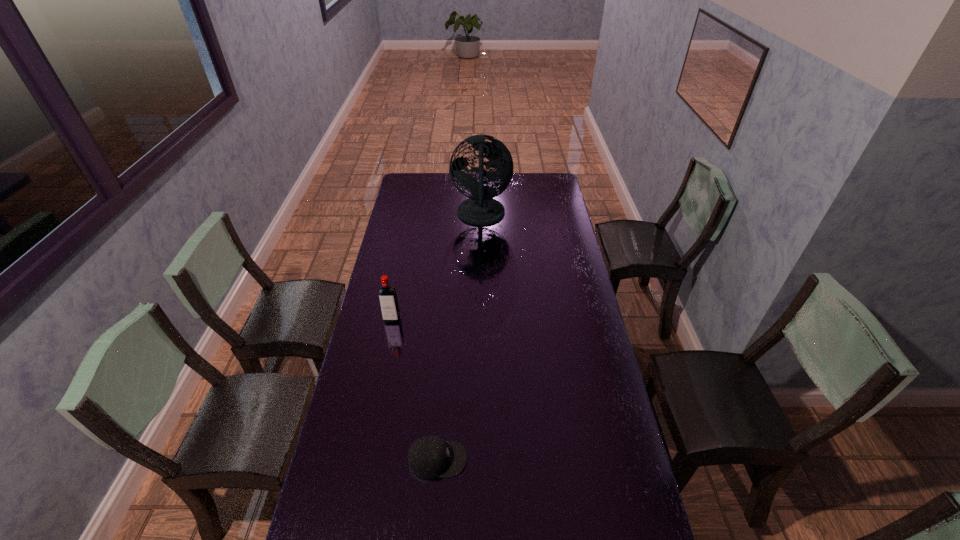
At what (x,y) coordinates should I click in order to perform the action: click on free space between the leftmost object and the tallest object. Please return your answer as a coordinate pair (x, y). The image size is (960, 540). Looking at the image, I should click on (437, 267).

Locate an element on the screen. This screenshot has height=540, width=960. free space between the leftmost object and the shortest object is located at coordinates (415, 389).

The image size is (960, 540). What are the coordinates of `the closest object to the second tallest object` in the screenshot? It's located at (429, 457).

Where is `object that is the closest to the leftmost object`? object that is the closest to the leftmost object is located at coordinates point(429,457).

Locate an element on the screen. vacant point that satisfies the following two spatial constraints: 1. on the front-facing side of the globe; 2. on the front and back of the leftmost object is located at coordinates (481, 319).

Locate an element on the screen. The image size is (960, 540). free space that satisfies the following two spatial constraints: 1. on the front-facing side of the farthest object; 2. on the front and back of the second tallest object is located at coordinates (481, 319).